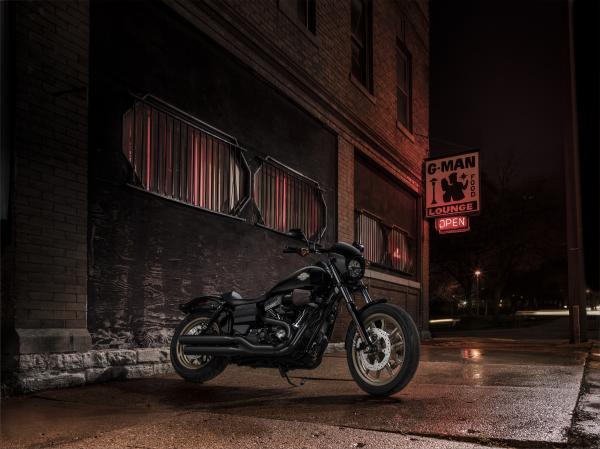
The image size is (600, 449). Find the location of `bar`. bar is located at coordinates (282, 199).